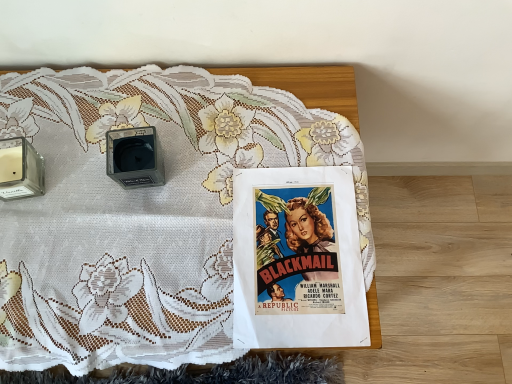
The width and height of the screenshot is (512, 384). What are the coordinates of `blank space situated above white lace tablecloth at upper center (from a real-world perspective)` in the screenshot? It's located at (148, 252).